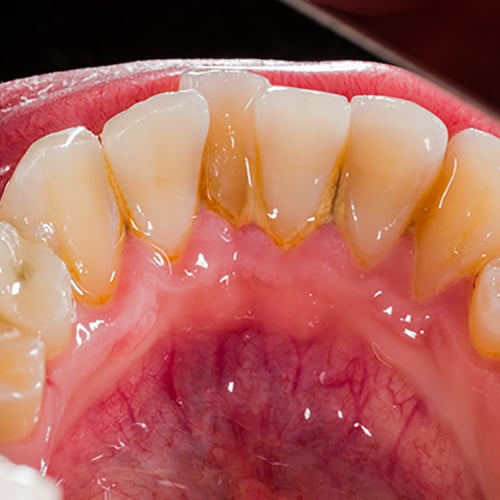
Find the location of a particular element. This screenshot has width=500, height=500. stains is located at coordinates [250, 200].